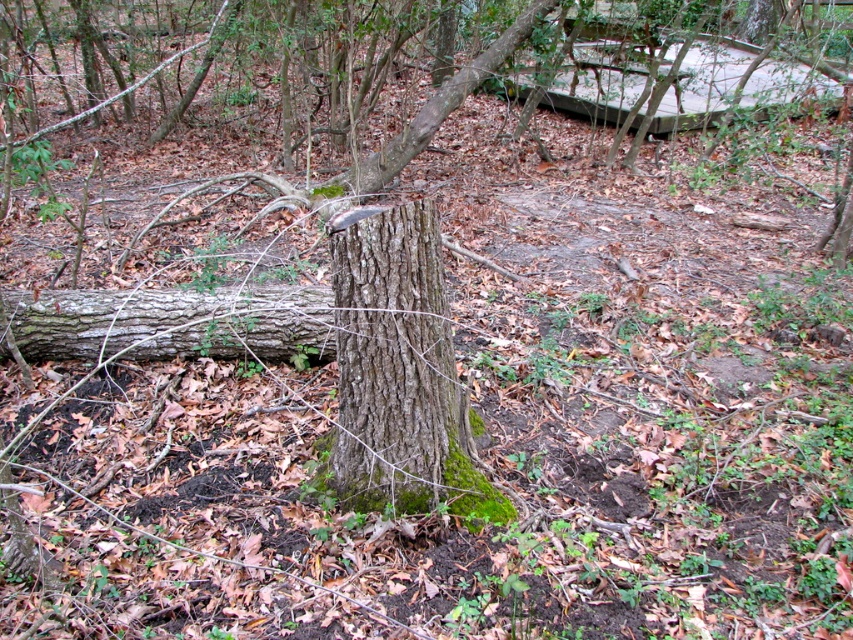
You are a hiker trying to cross the forest floor. You see the green mossy bark at center and the brown rough log at center. Which object is closer to the ground?

The green mossy bark at center is located below the brown rough log at center, so it is closer to the ground.

You are a hiker who wants to place a small marker at point (396, 369). According to the scene description, what will the marker be placed on?

The marker will be placed on the green mossy bark at center located at point (396, 369).